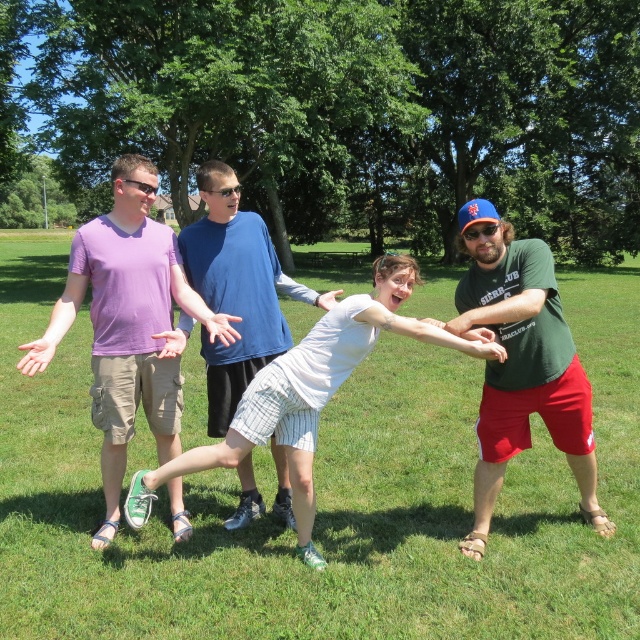
Question: Which object appears closest to the camera in this image?

Choices:
 (A) purple cotton shirt at left
 (B) white cotton shirt at center
 (C) green matte shirt at center

Answer: (B)

Question: Is green matte shirt at center thinner than white cotton shirt at center?

Choices:
 (A) yes
 (B) no

Answer: (A)

Question: Is green grass at center positioned behind white cotton shirt at center?

Choices:
 (A) yes
 (B) no

Answer: (A)

Question: Is purple cotton shirt at left behind white cotton shirt at center?

Choices:
 (A) no
 (B) yes

Answer: (B)

Question: Estimate the real-world distances between objects in this image. Which object is closer to the green matte shirt at center?

Choices:
 (A) white cotton shirt at center
 (B) purple cotton shirt at left
 (C) white striped shorts at center

Answer: (A)

Question: Estimate the real-world distances between objects in this image. Which object is closer to the green matte shirt at center?

Choices:
 (A) white striped shorts at center
 (B) white cotton shirt at center
 (C) purple cotton shirt at left

Answer: (B)